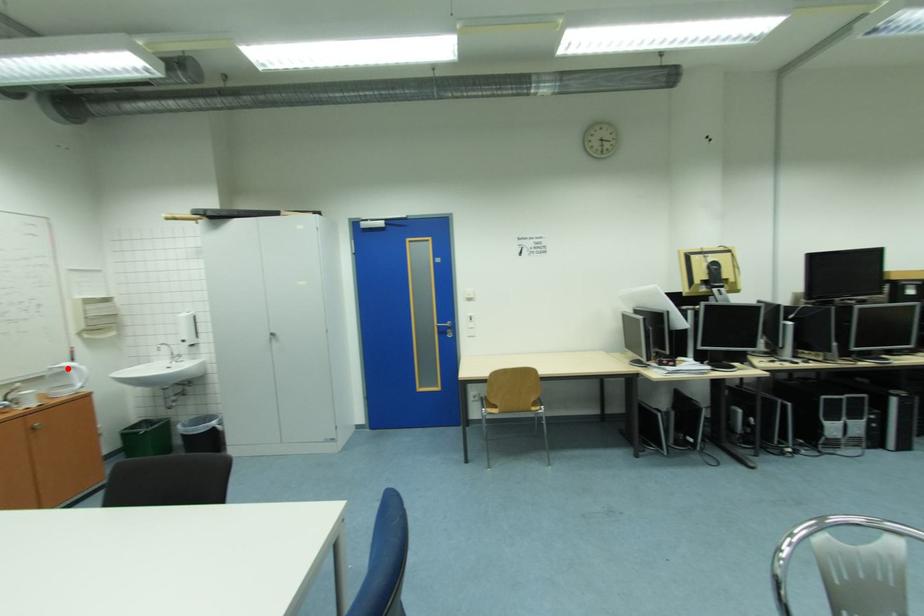
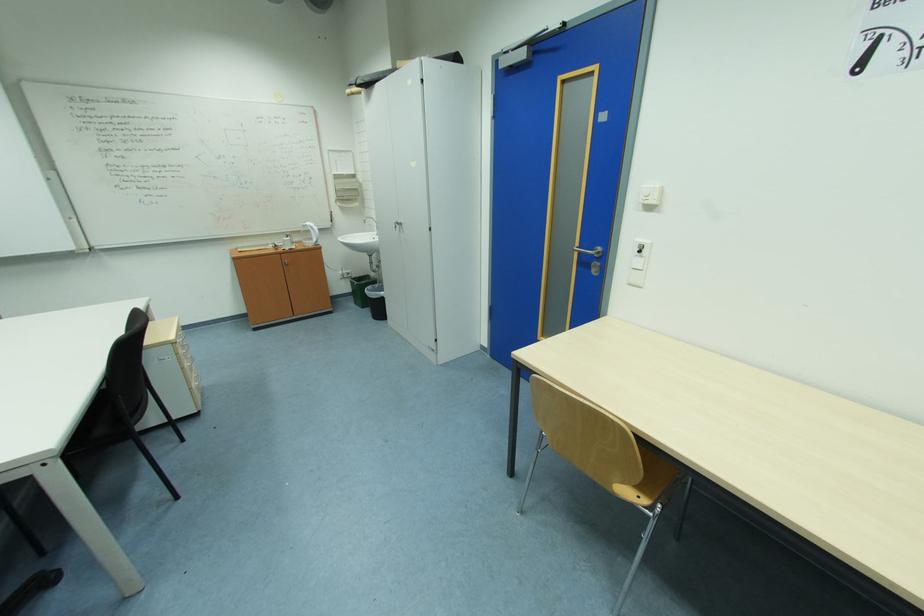
In the second image, find the point that corresponds to the highlighted location in the first image.

(313, 225)